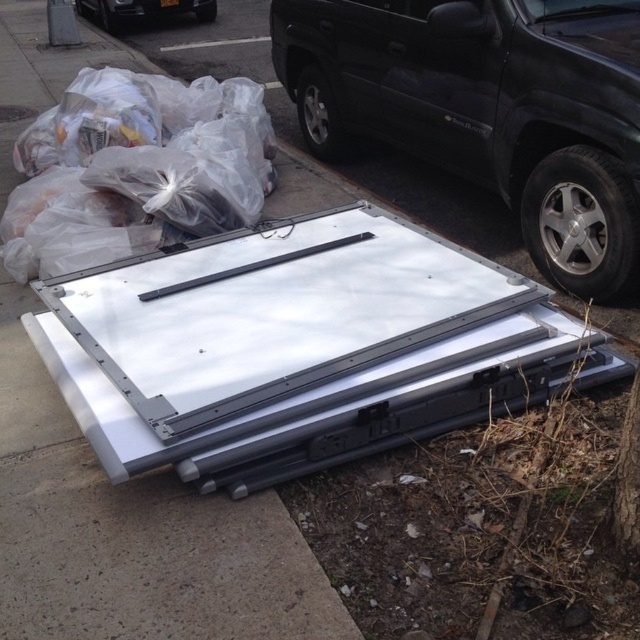
Is point (140, 609) behind point (272, 138)?

No.

Between point (29, 632) and point (99, 189), which one is positioned behind?

The point (99, 189) is more distant.

I want to click on white plastic container at lower center, so click(132, 534).

Who is shorter, clear plastic bags at upper left or brown rough bark at lower right?

With less height is brown rough bark at lower right.

In the scene shown: Measure the distance between clear plastic bags at upper left and camera.

clear plastic bags at upper left is 2.93 meters from camera.

Which is in front, point (29, 260) or point (634, 486)?

Positioned in front is point (634, 486).

You are a GUI agent. You are given a task and a screenshot of the screen. Output one action in this format:
    pyautogui.click(x=<x>, y=<y>)
    Task: Click on the clear plastic bags at upper left
    The width and height of the screenshot is (640, 640).
    Given the screenshot: What is the action you would take?
    pyautogui.click(x=134, y=170)

Who is positioned more to the right, black plastic suv at upper right or clear plastic bags at upper left?

black plastic suv at upper right is more to the right.

Does black plastic suv at upper right appear under clear plastic bags at upper left?

No, black plastic suv at upper right is not below clear plastic bags at upper left.

Image resolution: width=640 pixels, height=640 pixels. I want to click on black plastic suv at upper right, so click(488, 109).

Locate an element on the screen. black plastic suv at upper right is located at coordinates (488, 109).